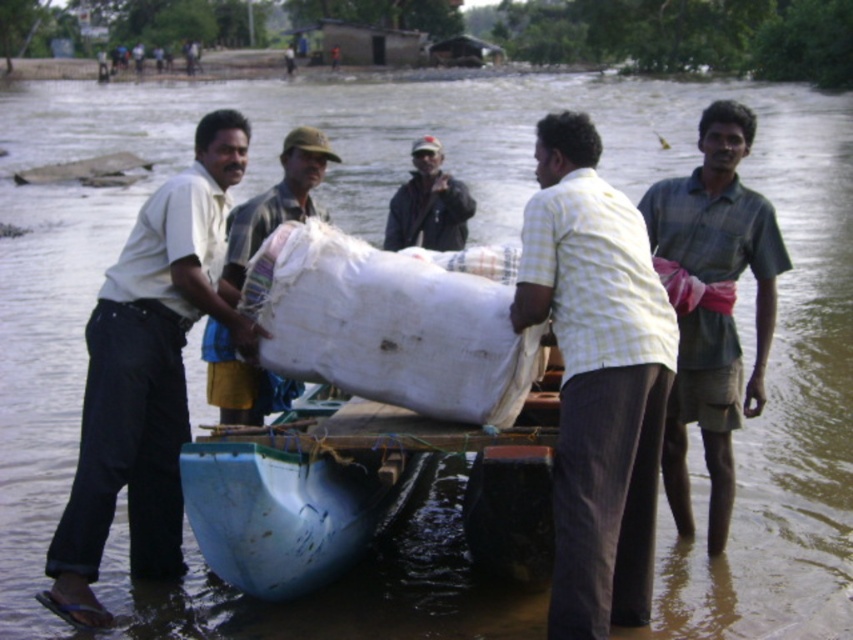
Is white cotton shirt at left further to camera compared to dark gray jacket at center?

No, white cotton shirt at left is closer to the viewer.

Who is positioned more to the right, white cotton shirt at left or dark gray jacket at center?

dark gray jacket at center is more to the right.

Does point (136, 396) come in front of point (459, 186)?

That is True.

I want to click on white cotton shirt at left, so click(x=148, y=374).

Based on the photo, who is taller, blue plastic boat at center or light brown fabric bag at center?

blue plastic boat at center is taller.

What do you see at coordinates (357, 401) in the screenshot? The image size is (853, 640). I see `blue plastic boat at center` at bounding box center [357, 401].

Does point (376, 460) lie behind point (289, 387)?

No, it is in front of (289, 387).

Locate an element on the screen. blue plastic boat at center is located at coordinates (357, 401).

Which of these two, blue plastic boat at center or light yellow checkered shirt at center, stands taller?

With more height is light yellow checkered shirt at center.

Between point (335, 260) and point (648, 248), which one is positioned behind?

Point (335, 260)

Measure the distance between blue plastic boat at center and camera.

They are 21.31 feet apart.

Identify the location of blue plastic boat at center. The image size is (853, 640). coord(357,401).